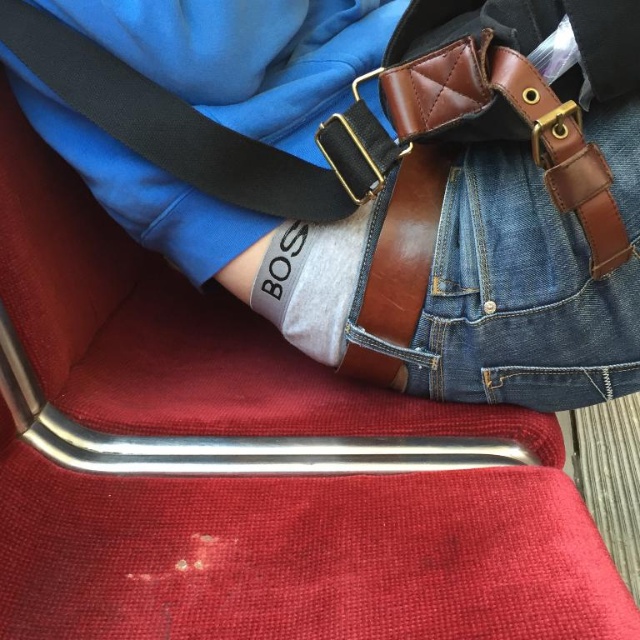
You are a tailor measuring the distance between two points on a belt for alterations. The points are labeled as point (376, 61) and point (576, 307). According to the image, which point is closer to the viewer?

Point (576, 307) is closer to the viewer since it is in front of point (376, 61).

You are a photographer trying to capture the details of the brown leather bag at center and the denim at center. Which object should you focus on first to ensure it appears larger in the photo?

The brown leather bag at center is closer to the viewer than the denim at center, so focusing on it first will make it appear larger in the photo.